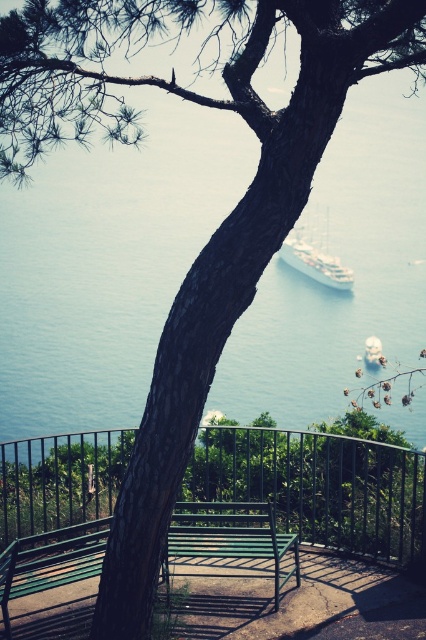
Between green metal bench at lower left and white glossy ship at center, which one appears on the left side from the viewer's perspective?

From the viewer's perspective, green metal bench at lower left appears more on the left side.

Is green metal bench at lower left positioned at the back of white glossy ship at center?

That is False.

Which is in front, point (28, 586) or point (307, 266)?

Positioned in front is point (28, 586).

The image size is (426, 640). What are the coordinates of `green metal bench at lower left` in the screenshot? It's located at (51, 561).

From the picture: Can you confirm if green metal bench at center is taller than green metal bench at lower left?

Yes, green metal bench at center is taller than green metal bench at lower left.

Which of these two, green metal bench at center or green metal bench at lower left, stands shorter?

green metal bench at lower left

Does point (282, 586) come behind point (89, 572)?

Yes, it is behind point (89, 572).

Identify the location of green metal bench at center. Image resolution: width=426 pixels, height=640 pixels. (230, 536).

Is green metal fence at center positioned at the back of green metal bench at lower left?

That is True.

Is point (400, 490) less distant than point (86, 541)?

That is False.

Where is `green metal fence at center`? The width and height of the screenshot is (426, 640). green metal fence at center is located at coordinates (319, 486).